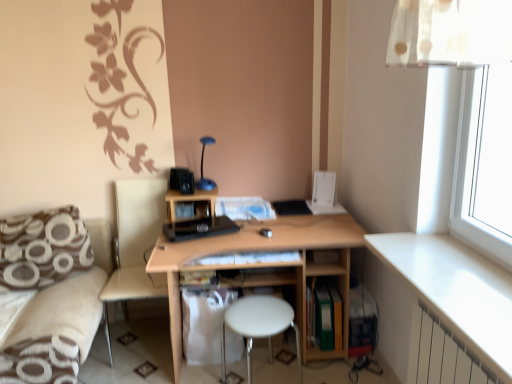
Find the location of a particular element. vacant space situated on the left part of green matte folder at lower center, which ranks as the 3th book in top-to-bottom order is located at coordinates (293, 349).